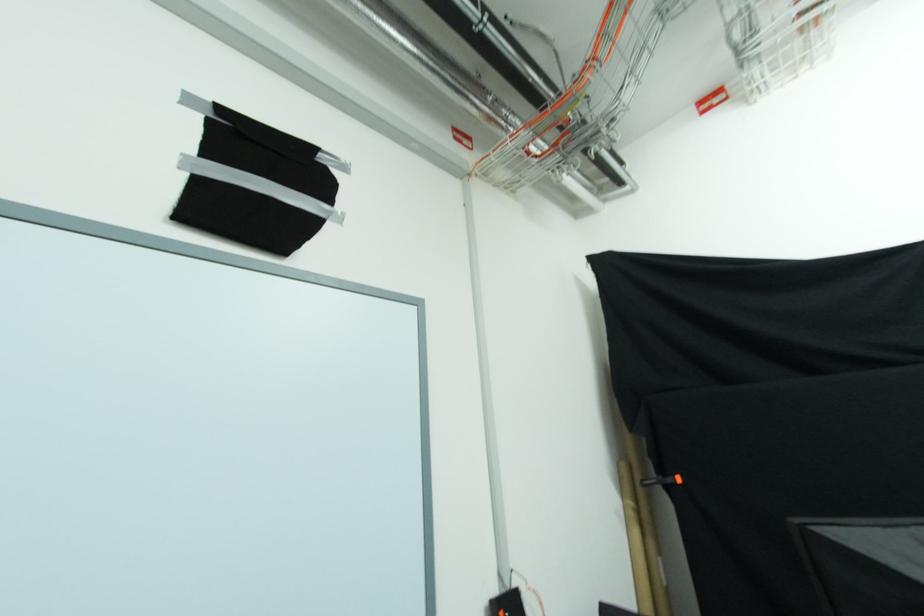
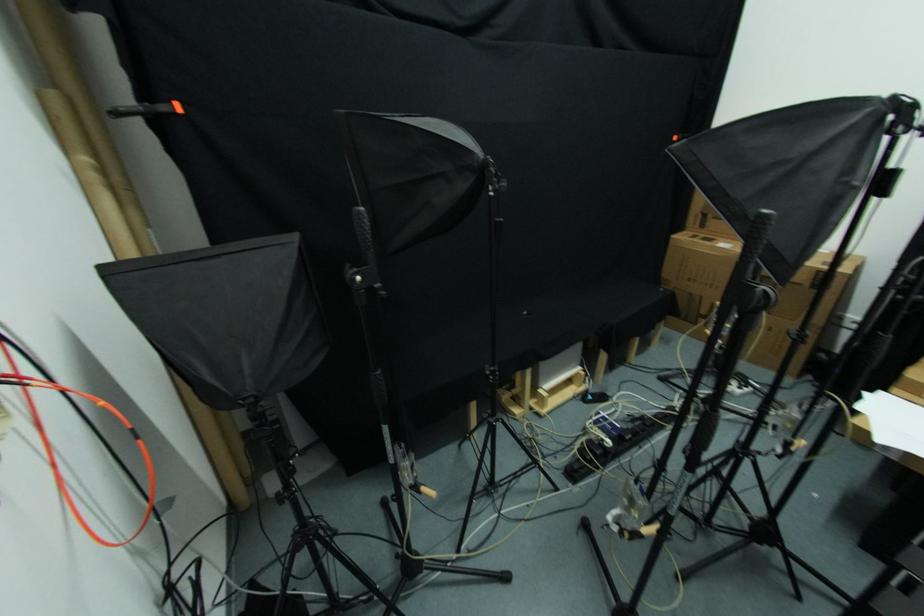
The first image is from the beginning of the video and the second image is from the end. How did the camera likely rotate when shooting the video?

The camera rotated toward right-down.